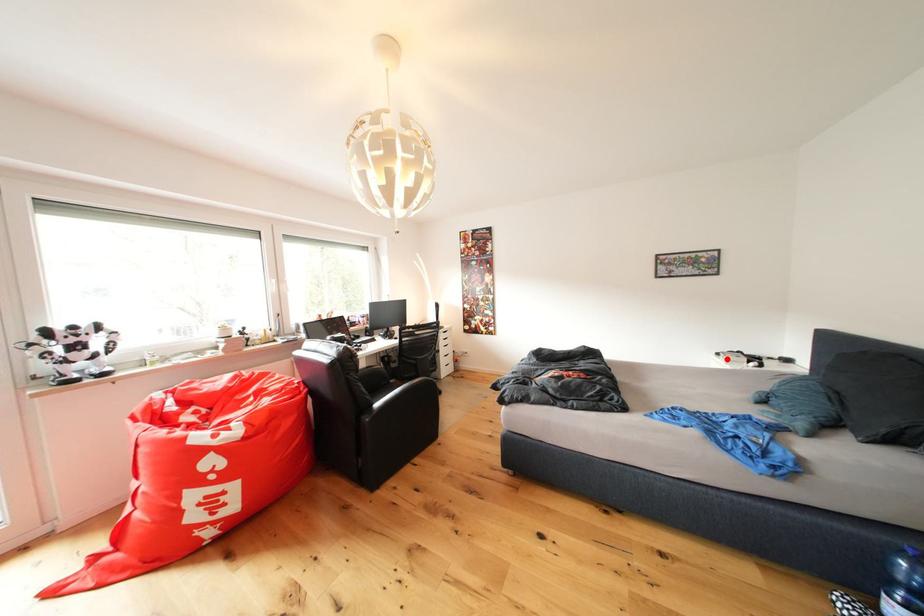
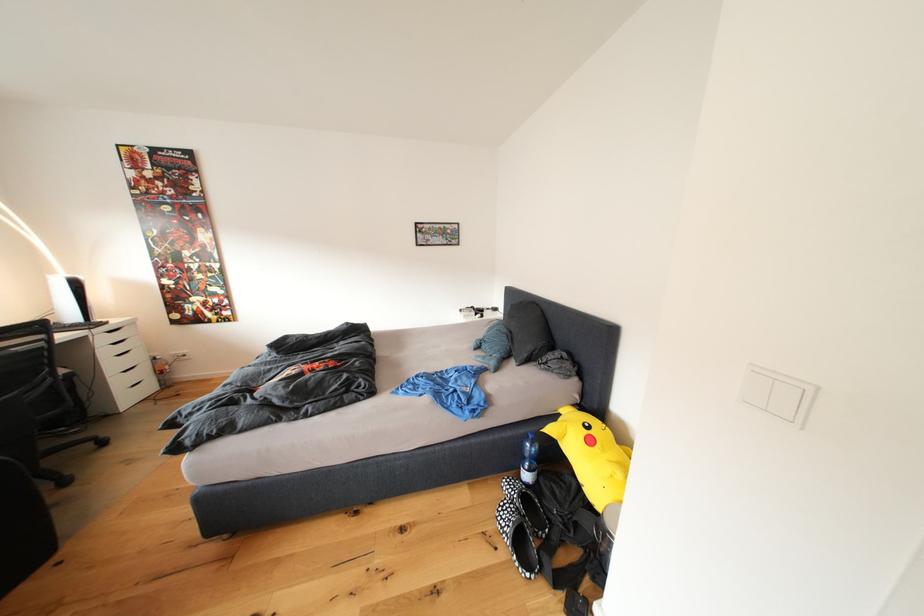
The point at the highlighted location is marked in the first image. Where is the corresponding point in the second image?

(469, 315)